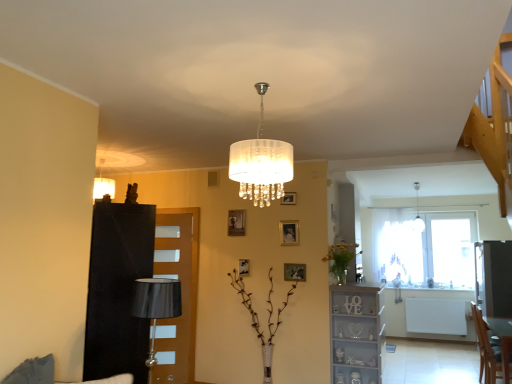
Question: Is black leather dresser at left oriented towards gold metallic picture frame at center, the 5th picture frame positioned from the left?

Choices:
 (A) yes
 (B) no

Answer: (A)

Question: Does black leather dresser at left appear on the left side of gold metallic picture frame at center, which is the fifth picture frame from top to bottom?

Choices:
 (A) no
 (B) yes

Answer: (B)

Question: Does black leather dresser at left have a greater width compared to gold metallic picture frame at center, which is the fifth picture frame from top to bottom?

Choices:
 (A) no
 (B) yes

Answer: (B)

Question: Does black leather dresser at left have a greater height compared to gold metallic picture frame at center, the first picture frame in the right-to-left sequence?

Choices:
 (A) yes
 (B) no

Answer: (A)

Question: From a real-world perspective, is black leather dresser at left physically above gold metallic picture frame at center, which is the fifth picture frame from top to bottom?

Choices:
 (A) no
 (B) yes

Answer: (A)

Question: In terms of size, does white crystal chandelier at center, marked as the first lamp in a left-to-right arrangement, appear bigger or smaller than wooden table at lower right?

Choices:
 (A) big
 (B) small

Answer: (B)

Question: In the image, is white crystal chandelier at center, which ranks as the 2th lamp in back-to-front order, on the left side or the right side of wooden table at lower right?

Choices:
 (A) left
 (B) right

Answer: (A)

Question: Does point (275, 185) appear closer or farther from the camera than point (505, 344)?

Choices:
 (A) closer
 (B) farther

Answer: (A)

Question: Is white crystal chandelier at center, which appears as the second lamp when viewed from the right, spatially inside wooden table at lower right, or outside of it?

Choices:
 (A) inside
 (B) outside

Answer: (B)

Question: Considering the positions of white crystal chandelier at center, marked as the first lamp in a left-to-right arrangement, and metallic gold picture frame at center, positioned as the 4th picture frame in right-to-left order, in the image, is white crystal chandelier at center, marked as the first lamp in a left-to-right arrangement, bigger or smaller than metallic gold picture frame at center, positioned as the 4th picture frame in right-to-left order,?

Choices:
 (A) big
 (B) small

Answer: (A)

Question: Is point (262, 147) positioned closer to the camera than point (239, 261)?

Choices:
 (A) farther
 (B) closer

Answer: (B)

Question: Is white crystal chandelier at center, which ranks as the 2th lamp in back-to-front order, taller or shorter than metallic gold picture frame at center, the 2th picture frame in the left-to-right sequence?

Choices:
 (A) tall
 (B) short

Answer: (A)

Question: Considering their positions, is white crystal chandelier at center, the first lamp viewed from the front, located in front of or behind metallic gold picture frame at center, the second picture frame when ordered from bottom to top?

Choices:
 (A) front
 (B) behind

Answer: (A)

Question: Visually, is matte gold picture frame at center, which ranks as the 2th picture frame in right-to-left order, positioned to the left or to the right of white wood shelf at lower right?

Choices:
 (A) right
 (B) left

Answer: (B)

Question: Is point (297, 241) closer or farther from the camera than point (348, 311)?

Choices:
 (A) closer
 (B) farther

Answer: (A)